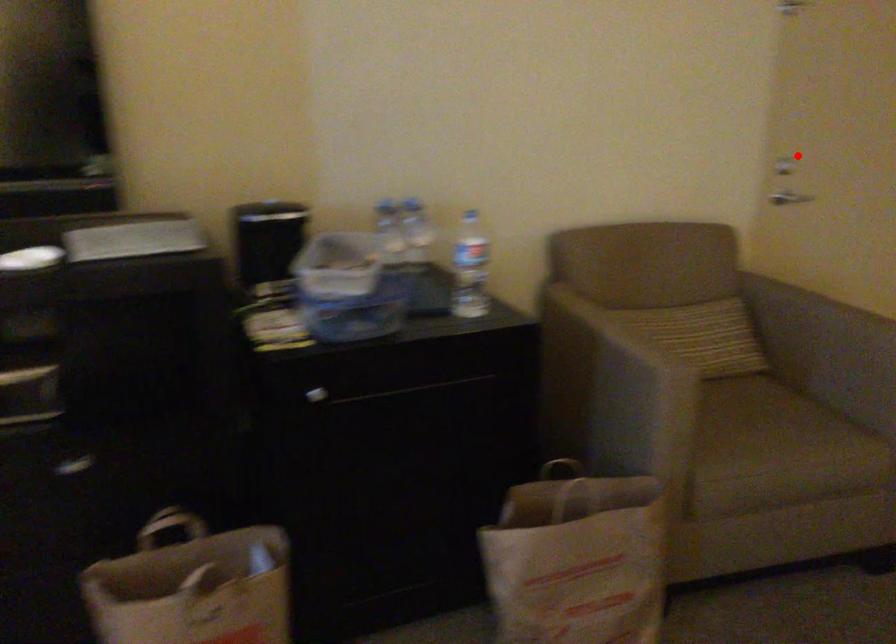
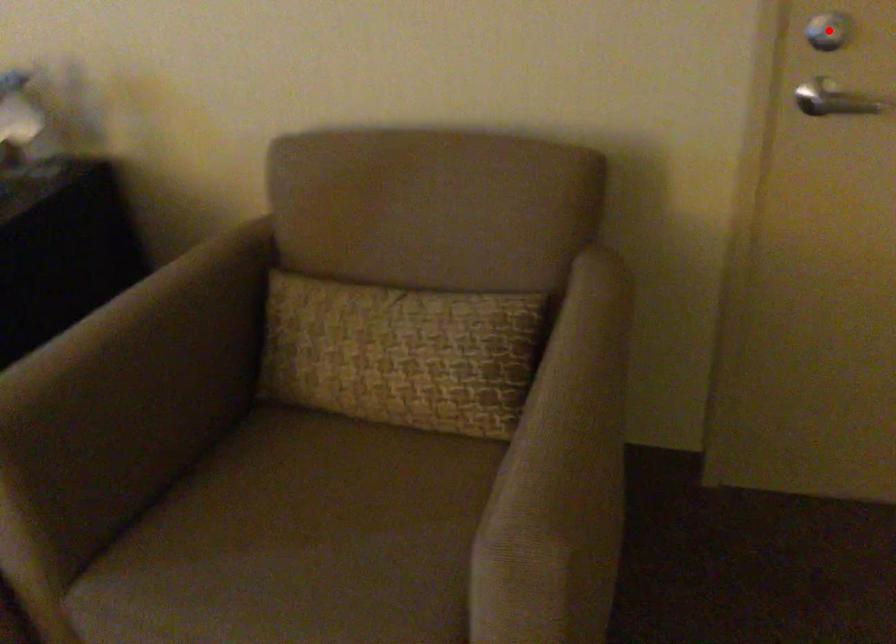
I am providing you with two images of the same scene from different viewpoints. A red point is marked on the first image and another point is marked on the second image. Are the points marked in image1 and image2 representing the same 3D position?

Yes